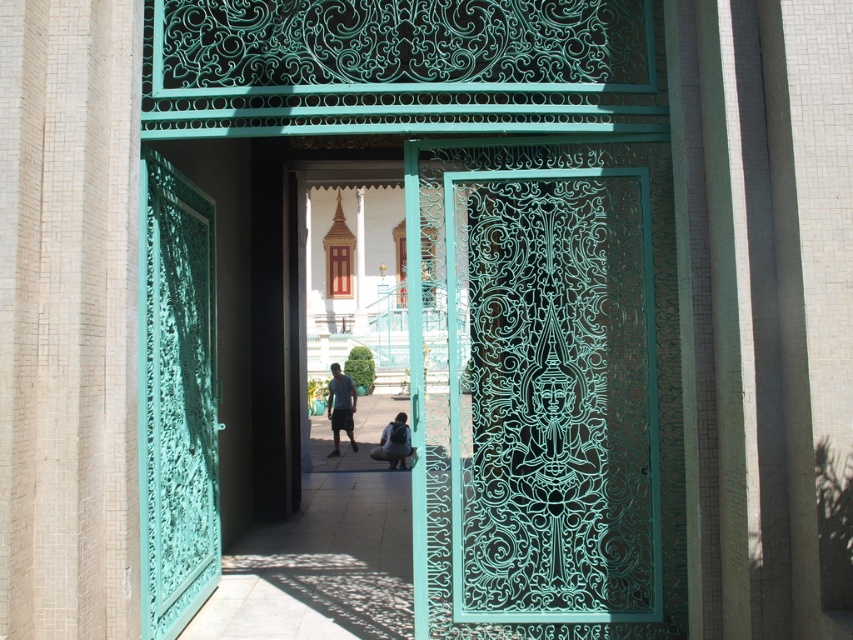
Question: Among these objects, which one is farthest from the camera?

Choices:
 (A) green carved door at center
 (B) dark blue t-shirt at center
 (C) matte black backpack at center
 (D) green carved wood door at left

Answer: (B)

Question: Considering the real-world distances, which object is closest to the dark blue t-shirt at center?

Choices:
 (A) green carved door at center
 (B) green carved wood door at left

Answer: (B)

Question: Which object appears farthest from the camera in this image?

Choices:
 (A) green carved door at center
 (B) green carved wood door at left

Answer: (B)

Question: Does green carved wood door at left appear on the right side of matte black backpack at center?

Choices:
 (A) no
 (B) yes

Answer: (A)

Question: Does green carved wood door at left appear over dark blue t-shirt at center?

Choices:
 (A) yes
 (B) no

Answer: (A)

Question: In this image, where is green carved door at center located relative to green carved wood door at left?

Choices:
 (A) left
 (B) right

Answer: (B)